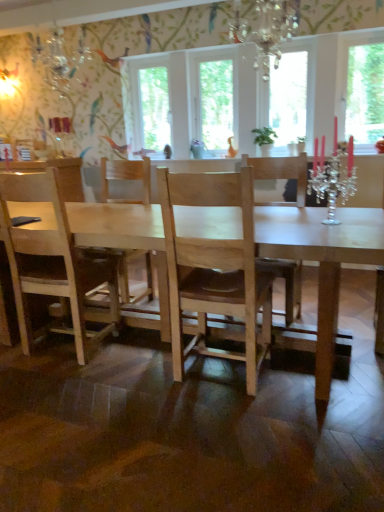
Question: Does point 253,66 appear closer or farther from the camera than point 261,139?

Choices:
 (A) closer
 (B) farther

Answer: (A)

Question: Is crystal chandelier at upper center spatially inside green matte plant at upper center, or outside of it?

Choices:
 (A) inside
 (B) outside

Answer: (B)

Question: Which object is positioned farthest from the crystal chandelier at upper center?

Choices:
 (A) clear glass window at center, acting as the 1th window screen starting from the left
 (B) light wood table at center
 (C) transparent glass window at center, positioned as the third window screen in left-to-right order
 (D) light wood chair at center
 (E) transparent glass window at upper right, arranged as the 4th window screen when viewed from the left

Answer: (B)

Question: Which object is positioned closest to the transparent glass window at upper right, arranged as the 4th window screen when viewed from the left?

Choices:
 (A) crystal chandelier at upper center
 (B) transparent glass window at center, the third window screen in the right-to-left sequence
 (C) light wood table at center
 (D) clear glass window at center, acting as the 1th window screen starting from the left
 (E) transparent glass window at center, positioned as the third window screen in left-to-right order

Answer: (E)